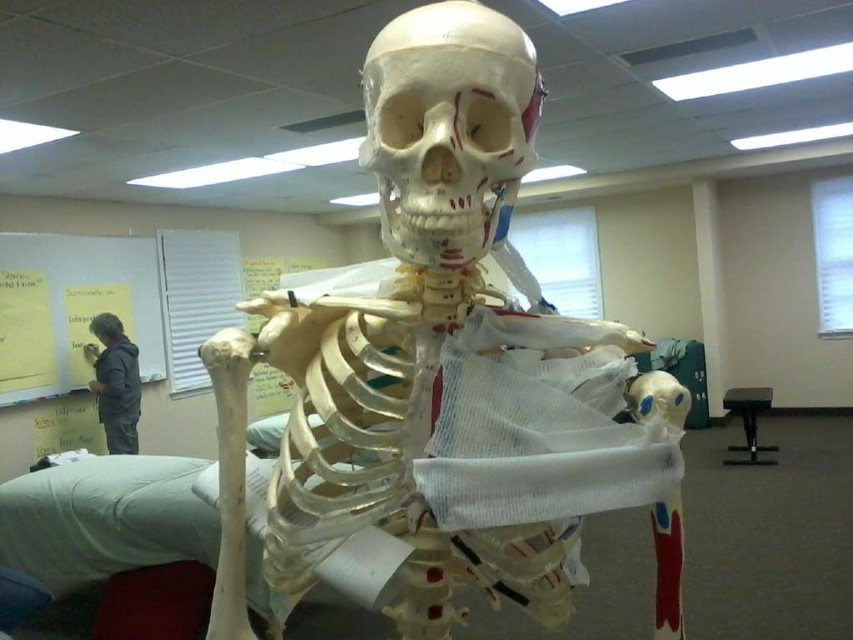
Question: Which object is the closest to the white matte skull at center?

Choices:
 (A) dark gray jacket at upper left
 (B) white paperboard at upper left

Answer: (A)

Question: Is white matte skull at center to the right of dark gray jacket at upper left from the viewer's perspective?

Choices:
 (A) yes
 (B) no

Answer: (A)

Question: Is white paperboard at upper left smaller than dark gray jacket at upper left?

Choices:
 (A) yes
 (B) no

Answer: (B)

Question: Which is farther from the white paperboard at upper left?

Choices:
 (A) dark gray jacket at upper left
 (B) white matte skull at center

Answer: (B)

Question: Observing the image, what is the correct spatial positioning of white paperboard at upper left in reference to dark gray jacket at upper left?

Choices:
 (A) right
 (B) left

Answer: (B)

Question: Estimate the real-world distances between objects in this image. Which object is closer to the dark gray jacket at upper left?

Choices:
 (A) white paperboard at upper left
 (B) white matte skull at center

Answer: (A)